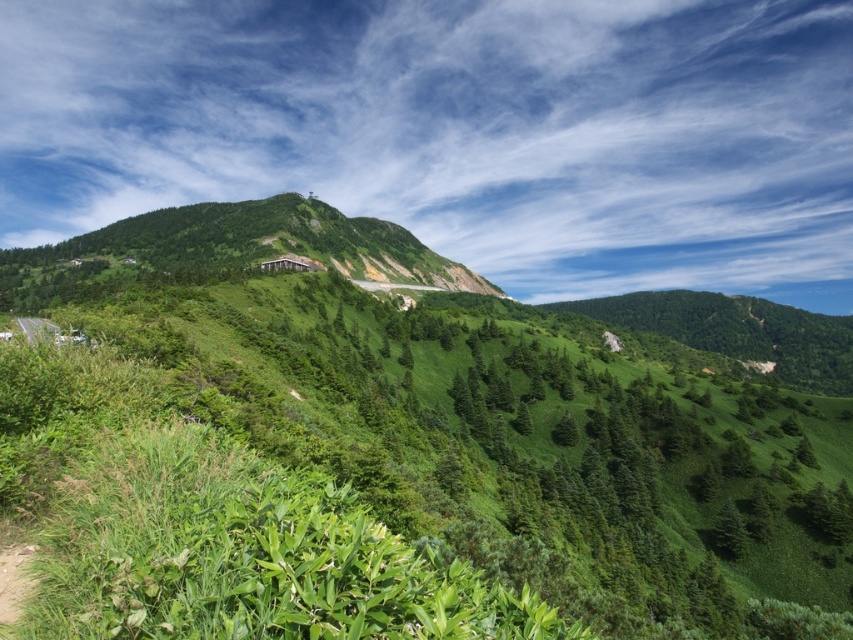
Question: Which point is closer to the camera taking this photo?

Choices:
 (A) [x=276, y=353]
 (B) [x=106, y=250]

Answer: (A)

Question: Can you confirm if green leafy shrubs at center is positioned below green grassy hill at center?

Choices:
 (A) yes
 (B) no

Answer: (A)

Question: Among these objects, which one is nearest to the camera?

Choices:
 (A) green leafy shrubs at center
 (B) green grassy hill at center

Answer: (A)

Question: Can you confirm if green leafy shrubs at center is positioned above green grassy hill at center?

Choices:
 (A) no
 (B) yes

Answer: (A)

Question: Considering the relative positions of green leafy shrubs at center and green grassy hill at center in the image provided, where is green leafy shrubs at center located with respect to green grassy hill at center?

Choices:
 (A) above
 (B) below

Answer: (B)